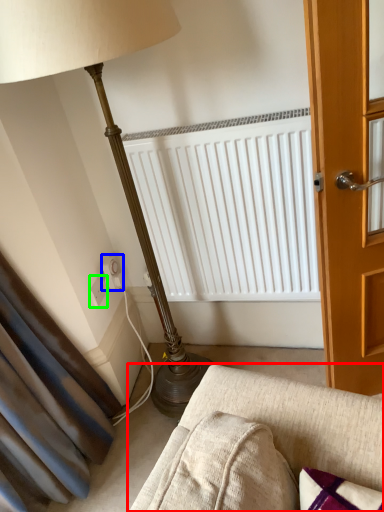
Question: Estimate the real-world distances between objects in this image. Which object is farther from studio couch (highlighted by a red box), electric outlet (highlighted by a blue box) or electric outlet (highlighted by a green box)?

Choices:
 (A) electric outlet
 (B) electric outlet

Answer: (A)